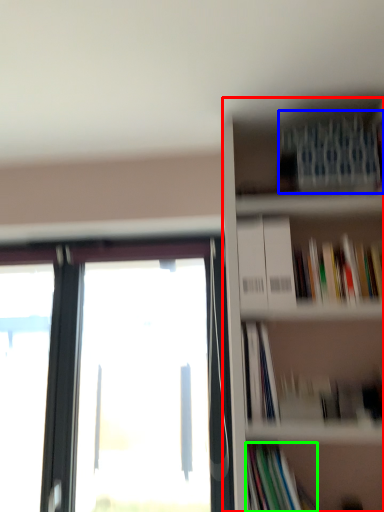
Question: Which object is the closest to the bookcase (highlighted by a red box)? Choose among these: book (highlighted by a blue box) or book (highlighted by a green box).

Choices:
 (A) book
 (B) book

Answer: (A)